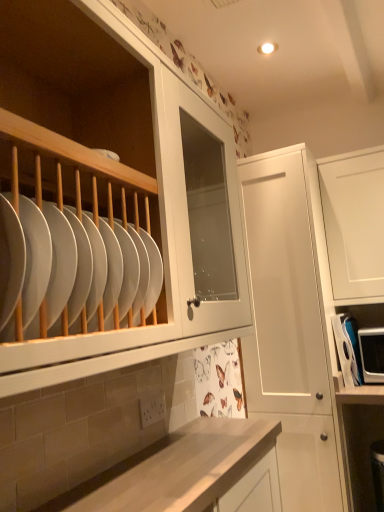
Where is `white glossy plate at left`? This screenshot has height=512, width=384. white glossy plate at left is located at coordinates (83, 265).

Identify the location of white glossy plate at left. (83, 265).

Considering the positions of objects white glossy plate at left and white matte cabinet at center in the image provided, who is more to the right, white glossy plate at left or white matte cabinet at center?

white matte cabinet at center is more to the right.

Is white glossy plate at left oriented towards white matte cabinet at center?

No.

Is white glossy plate at left not inside white matte cabinet at center?

Yes, white glossy plate at left is located beyond the bounds of white matte cabinet at center.

Can you confirm if white glossy plate at left is bigger than white matte cabinet at center?

Incorrect, white glossy plate at left is not larger than white matte cabinet at center.

Can you confirm if white matte cabinet at center is taller than white glossy plate at left?

Yes, white matte cabinet at center is taller than white glossy plate at left.

From a real-world perspective, which is physically above, white matte cabinet at center or white glossy plate at left?

white glossy plate at left, from a real-world perspective.

Is white matte cabinet at center wider or thinner than white glossy plate at left?

white matte cabinet at center is wider than white glossy plate at left.

Is white matte cabinet at center oriented away from white glossy plate at left?

No, white matte cabinet at center is not facing away from white glossy plate at left.

Would you say white plastic microwave at right is outside white matte cabinet at center?

Indeed, white plastic microwave at right is completely outside white matte cabinet at center.

Considering the relative positions of white plastic microwave at right and white matte cabinet at center in the image provided, is white plastic microwave at right to the left of white matte cabinet at center from the viewer's perspective?

No.

Is white plastic microwave at right oriented towards white matte cabinet at center?

No, white plastic microwave at right does not turn towards white matte cabinet at center.

From a real-world perspective, does white plastic microwave at right sit lower than white matte cabinet at center?

Yes, from a real-world perspective, white plastic microwave at right is under white matte cabinet at center.

Where is `shelf on the right of white glossy plate at left`? shelf on the right of white glossy plate at left is located at coordinates (348, 349).

Considering the sizes of objects white glossy plate at left and white plastic microwave at right in the image provided, who is wider, white glossy plate at left or white plastic microwave at right?

With larger width is white plastic microwave at right.

Which is closer to the camera, [101,260] or [346,329]?

Clearly, point [101,260] is closer to the camera than point [346,329].

Is white matte cabinet at center thinner than white plastic microwave at right?

In fact, white matte cabinet at center might be wider than white plastic microwave at right.

How much distance is there between white matte cabinet at center and white plastic microwave at right?

white matte cabinet at center and white plastic microwave at right are 11.41 inches apart from each other.

Can you confirm if white matte cabinet at center is smaller than white plastic microwave at right?

No, white matte cabinet at center is not smaller than white plastic microwave at right.

In the scene shown: Does white matte cabinet at center appear on the right side of white plastic microwave at right?

No.

Does white plastic microwave at right turn towards white glossy plate at left?

Yes.

The height and width of the screenshot is (512, 384). I want to click on shelf beneath the white glossy plate at left (from a real-world perspective), so click(x=348, y=349).

From a real-world perspective, is white plastic microwave at right physically located above or below white glossy plate at left?

From a real-world perspective, white plastic microwave at right is physically below white glossy plate at left.

Is the position of white plastic microwave at right less distant than that of white glossy plate at left?

No, white plastic microwave at right is behind white glossy plate at left.

Locate an element on the screen. This screenshot has height=512, width=384. tableware that appears in front of the white matte cabinet at center is located at coordinates (83, 265).

Where is `cabinetry beneath the white glossy plate at left (from a real-world perspective)`? cabinetry beneath the white glossy plate at left (from a real-world perspective) is located at coordinates (292, 325).

Based on their spatial positions, is white plastic microwave at right or white matte cabinet at center further from white glossy plate at left?

The object further to white glossy plate at left is white plastic microwave at right.

From the image, which object appears to be farther from white matte cabinet at center, white glossy plate at left or white plastic microwave at right?

The object further to white matte cabinet at center is white glossy plate at left.

Looking at the image, which one is located further to white plastic microwave at right, white matte cabinet at center or white glossy plate at left?

white glossy plate at left.

When comparing their distances from white plastic microwave at right, does white glossy plate at left or white matte cabinet at center seem closer?

white matte cabinet at center.

When comparing their distances from white glossy plate at left, does white matte cabinet at center or white plastic microwave at right seem closer?

Based on the image, white matte cabinet at center appears to be nearer to white glossy plate at left.

Looking at the image, which one is located closer to white matte cabinet at center, white plastic microwave at right or white glossy plate at left?

The object closer to white matte cabinet at center is white plastic microwave at right.

You are a GUI agent. You are given a task and a screenshot of the screen. Output one action in this format:
    pyautogui.click(x=<x>, y=<y>)
    Task: Click on the cabinetry between white glossy plate at left and white plastic microwave at right along the z-axis
    
    Given the screenshot: What is the action you would take?
    pyautogui.click(x=292, y=325)